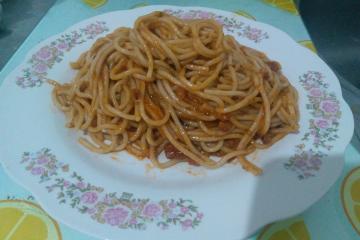
Identify the location of white plate. The height and width of the screenshot is (240, 360). (233, 201).